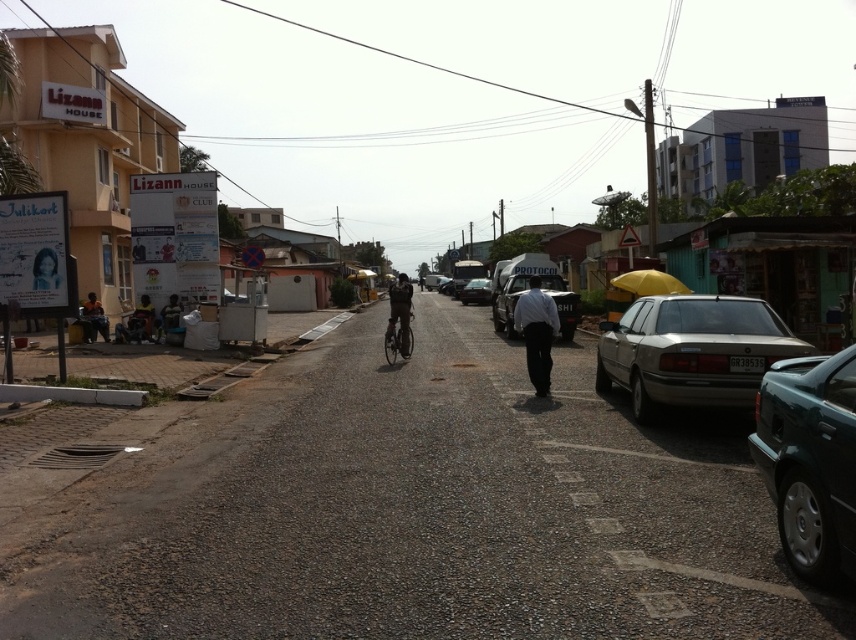
Does white shirt at center have a smaller size compared to dark green fabric bag at lower left?

Indeed, white shirt at center has a smaller size compared to dark green fabric bag at lower left.

In the scene shown: Which is above, white shirt at center or dark green fabric bag at lower left?

dark green fabric bag at lower left

The height and width of the screenshot is (640, 856). What do you see at coordinates (536, 332) in the screenshot?
I see `white shirt at center` at bounding box center [536, 332].

At what (x,y) coordinates should I click in order to perform the action: click on white shirt at center. Please return your answer as a coordinate pair (x, y). Looking at the image, I should click on (536, 332).

Between dark green fabric bag at left and shiny metallic bicycle at center, which one appears on the right side from the viewer's perspective?

From the viewer's perspective, shiny metallic bicycle at center appears more on the right side.

Is dark green fabric bag at left positioned in front of shiny metallic bicycle at center?

No, dark green fabric bag at left is behind shiny metallic bicycle at center.

Who is more forward, (140,305) or (409,348)?

Point (409,348) is in front.

The height and width of the screenshot is (640, 856). Find the location of `dark green fabric bag at left`. dark green fabric bag at left is located at coordinates (137, 323).

Measure the distance between satin silver sedan at right and dark brown leather jacket at center.

satin silver sedan at right is 8.60 meters away from dark brown leather jacket at center.

What do you see at coordinates (691, 352) in the screenshot? I see `satin silver sedan at right` at bounding box center [691, 352].

What do you see at coordinates (691, 352) in the screenshot? This screenshot has height=640, width=856. I see `satin silver sedan at right` at bounding box center [691, 352].

At what (x,y) coordinates should I click in order to perform the action: click on satin silver sedan at right. Please return your answer as a coordinate pair (x, y). Looking at the image, I should click on (691, 352).